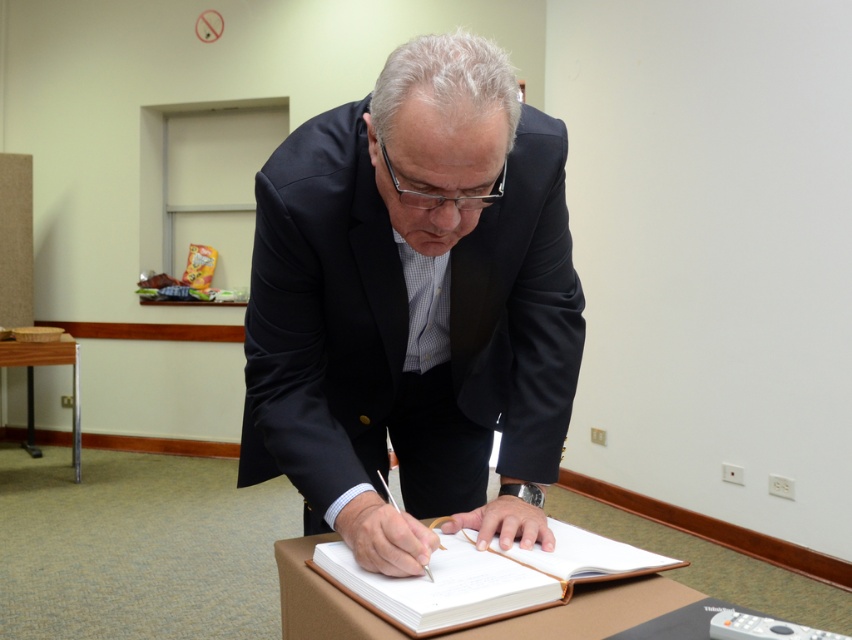
Question: Which point is farther to the camera?

Choices:
 (A) metallic silver table at lower left
 (B) black satin suit at center

Answer: (A)

Question: Is black satin suit at center below leather-bound notebook at center?

Choices:
 (A) yes
 (B) no

Answer: (B)

Question: Is the position of black satin suit at center more distant than that of leather-bound notebook at center?

Choices:
 (A) no
 (B) yes

Answer: (A)

Question: Observing the image, what is the correct spatial positioning of black satin suit at center in reference to leather-bound notebook at center?

Choices:
 (A) right
 (B) left

Answer: (B)

Question: Which of the following is the farthest from the observer?

Choices:
 (A) (648, 572)
 (B) (268, 195)

Answer: (B)

Question: Which of the following is the farthest from the observer?

Choices:
 (A) (55, 364)
 (B) (308, 502)

Answer: (A)